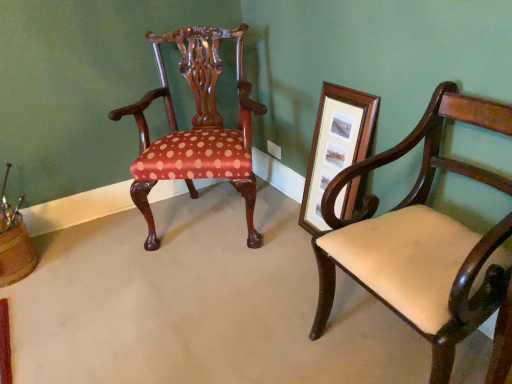
You are a GUI agent. You are given a task and a screenshot of the screen. Output one action in this format:
    pyautogui.click(x=<x>, y=<y>)
    Task: Click on the vacant space to the left of polished wood chair at center, arranged as the second chair when viewed from the front
    The image size is (512, 384).
    Given the screenshot: What is the action you would take?
    pyautogui.click(x=93, y=251)